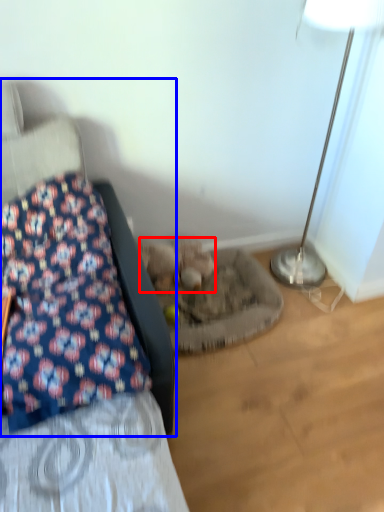
Question: Which of the following is the closest to the observer, animal (highlighted by a red box) or furniture (highlighted by a blue box)?

Choices:
 (A) animal
 (B) furniture

Answer: (B)